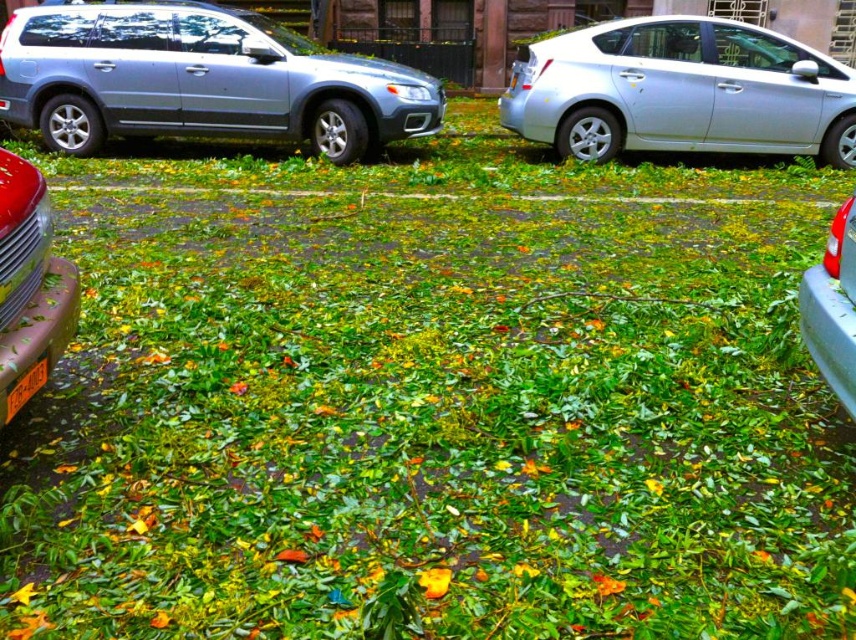
You are a delivery driver who needs to park your vehicle in this parking lot. There is a point marked at coordinates (681, 90) which indicates a satin silver sedan at right. Are there any other vehicles parked near that point that you should be aware of?

The satin silver sedan at right is located at point (681, 90). The silver station wagon on the left is parked further away from this point, so there are no other vehicles immediately near the satin silver sedan at right.

You are a parking attendant who needs to identify the vehicles in the parking lot. According to the image, is the metallic red car at left closer to you than the orange plastic license plate at lower left?

The metallic red car at left is in front of the orange plastic license plate at lower left, so yes, the metallic red car at left is closer to you than the orange plastic license plate at lower left.